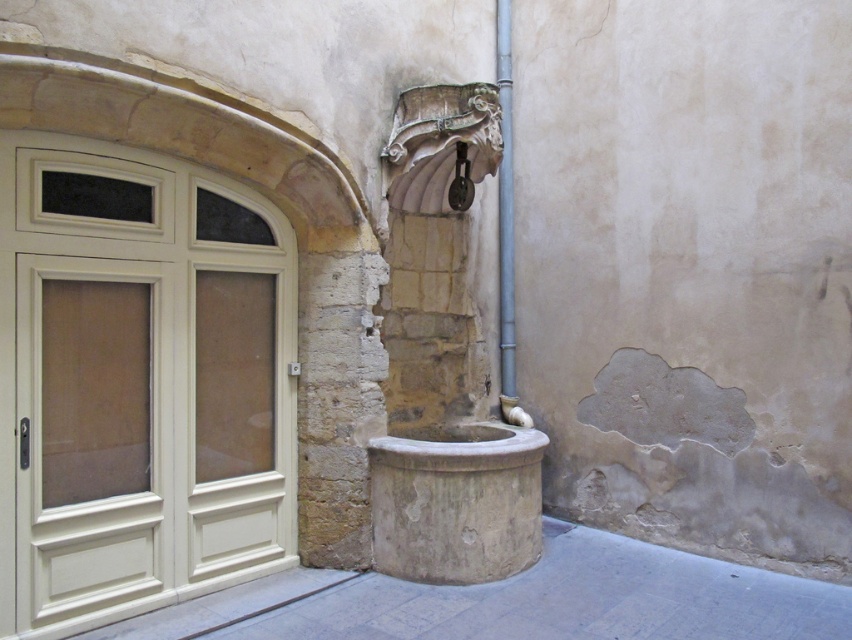
You are standing in the courtyard and need to exit through the cream colored door with a rectangular window. The white matte screen door at left is blocking your path. Can you move around it to reach the cream colored door?

The white matte screen door at left is located at point (95, 499), so you can move around it to reach the cream colored door.